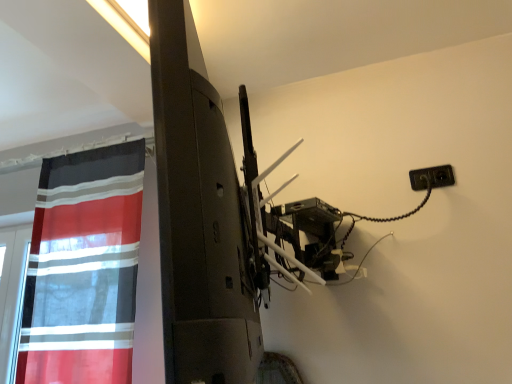
Question: Is point (38, 256) closer or farther from the camera than point (416, 172)?

Choices:
 (A) closer
 (B) farther

Answer: (B)

Question: Considering the positions of red sheer curtain at left and black plastic outlet at upper right in the image, is red sheer curtain at left wider or thinner than black plastic outlet at upper right?

Choices:
 (A) thin
 (B) wide

Answer: (B)

Question: In terms of size, does red sheer curtain at left appear bigger or smaller than black plastic outlet at upper right?

Choices:
 (A) big
 (B) small

Answer: (A)

Question: Considering the positions of black plastic outlet at upper right and red sheer curtain at left in the image, is black plastic outlet at upper right wider or thinner than red sheer curtain at left?

Choices:
 (A) wide
 (B) thin

Answer: (B)

Question: From their relative heights in the image, would you say black plastic outlet at upper right is taller or shorter than red sheer curtain at left?

Choices:
 (A) tall
 (B) short

Answer: (B)

Question: Based on their positions, is black plastic outlet at upper right located to the left or right of red sheer curtain at left?

Choices:
 (A) left
 (B) right

Answer: (B)

Question: Is black plastic outlet at upper right inside the boundaries of red sheer curtain at left, or outside?

Choices:
 (A) inside
 (B) outside

Answer: (B)